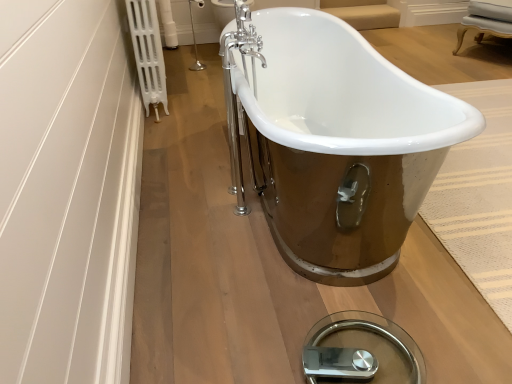
Find the location of a particular element. chrome metallic faucet at upper center is located at coordinates (223, 11).

Identify the location of chrome metallic faucet at upper center. (223, 11).

Which is correct: white porcelain bathtub at center is inside chrome metallic faucet at upper center, or outside of it?

The correct answer is: outside.

From the image's perspective, which one is positioned higher, white porcelain bathtub at center or chrome metallic faucet at upper center?

chrome metallic faucet at upper center is shown above in the image.

From their relative heights in the image, would you say white porcelain bathtub at center is taller or shorter than chrome metallic faucet at upper center?

Considering their sizes, white porcelain bathtub at center has less height than chrome metallic faucet at upper center.

From the picture: Does white plastic radiator at upper left have a lesser width compared to white porcelain bathtub at center?

Indeed, white plastic radiator at upper left has a lesser width compared to white porcelain bathtub at center.

Considering the relative positions of white plastic radiator at upper left and white porcelain bathtub at center in the image provided, is white plastic radiator at upper left to the left of white porcelain bathtub at center from the viewer's perspective?

Yes.

Does white plastic radiator at upper left have a greater height compared to white porcelain bathtub at center?

Indeed, white plastic radiator at upper left has a greater height compared to white porcelain bathtub at center.

From the image's perspective, is chrome metallic faucet at upper center located beneath white plastic radiator at upper left?

Incorrect, from the image's perspective, chrome metallic faucet at upper center is higher than white plastic radiator at upper left.

Who is bigger, chrome metallic faucet at upper center or white plastic radiator at upper left?

white plastic radiator at upper left.

Between chrome metallic faucet at upper center and white plastic radiator at upper left, which one has smaller width?

white plastic radiator at upper left is thinner.

Consider the image. How distant is chrome metallic faucet at upper center from white plastic radiator at upper left?

chrome metallic faucet at upper center is 1.57 meters away from white plastic radiator at upper left.

From a real-world perspective, between white porcelain bathtub at center and white plastic radiator at upper left, who is vertically higher?

white plastic radiator at upper left, from a real-world perspective.

From the image's perspective, between white porcelain bathtub at center and white plastic radiator at upper left, who is located below?

From the image's view, white porcelain bathtub at center is below.

Between white porcelain bathtub at center and white plastic radiator at upper left, which one has less height?

white porcelain bathtub at center is shorter.

Find the location of `bathtub lying below the white plastic radiator at upper left (from the image's perspective)`. bathtub lying below the white plastic radiator at upper left (from the image's perspective) is located at coordinates (341, 145).

Consider the image. From their relative heights in the image, would you say chrome metallic faucet at upper center is taller or shorter than white porcelain bathtub at center?

In the image, chrome metallic faucet at upper center appears to be taller than white porcelain bathtub at center.

Does chrome metallic faucet at upper center appear on the left side of white porcelain bathtub at center?

Yes.

Is white porcelain bathtub at center at the back of chrome metallic faucet at upper center?

No.

Is point (226, 2) more distant than point (225, 27)?

No, it is not.

Based on the photo, between white plastic radiator at upper left and chrome metallic faucet at upper center, which one has larger width?

chrome metallic faucet at upper center.

How many degrees apart are the facing directions of white plastic radiator at upper left and chrome metallic faucet at upper center?

white plastic radiator at upper left and chrome metallic faucet at upper center are facing 93.3 degrees away from each other.

Relative to chrome metallic faucet at upper center, is white plastic radiator at upper left in front or behind?

Clearly, white plastic radiator at upper left is in front of chrome metallic faucet at upper center.

Which of these two, white plastic radiator at upper left or chrome metallic faucet at upper center, stands taller?

With more height is white plastic radiator at upper left.

Identify the location of bathtub located underneath the chrome metallic faucet at upper center (from a real-world perspective). (x=341, y=145).

Where is `bathtub to the right of white plastic radiator at upper left`? bathtub to the right of white plastic radiator at upper left is located at coordinates (341, 145).

When comparing their distances from white plastic radiator at upper left, does white porcelain bathtub at center or chrome metallic faucet at upper center seem closer?

Based on the image, white porcelain bathtub at center appears to be nearer to white plastic radiator at upper left.

In the scene shown: Considering their positions, is chrome metallic faucet at upper center positioned closer to white porcelain bathtub at center than white plastic radiator at upper left?

Among the two, white plastic radiator at upper left is located nearer to white porcelain bathtub at center.

Considering their positions, is white plastic radiator at upper left positioned further to chrome metallic faucet at upper center than white porcelain bathtub at center?

white porcelain bathtub at center is further to chrome metallic faucet at upper center.

When comparing their distances from chrome metallic faucet at upper center, does white porcelain bathtub at center or white plastic radiator at upper left seem closer?

white plastic radiator at upper left.

Which object lies nearer to the anchor point white plastic radiator at upper left, chrome metallic faucet at upper center or white porcelain bathtub at center?

Based on the image, white porcelain bathtub at center appears to be nearer to white plastic radiator at upper left.

Estimate the real-world distances between objects in this image. Which object is closer to white porcelain bathtub at center, white plastic radiator at upper left or chrome metallic faucet at upper center?

white plastic radiator at upper left lies closer to white porcelain bathtub at center than the other object.

At what (x,y) coordinates should I click in order to perform the action: click on radiator located between white porcelain bathtub at center and chrome metallic faucet at upper center in the depth direction. Please return your answer as a coordinate pair (x, y). This screenshot has height=384, width=512. Looking at the image, I should click on (148, 53).